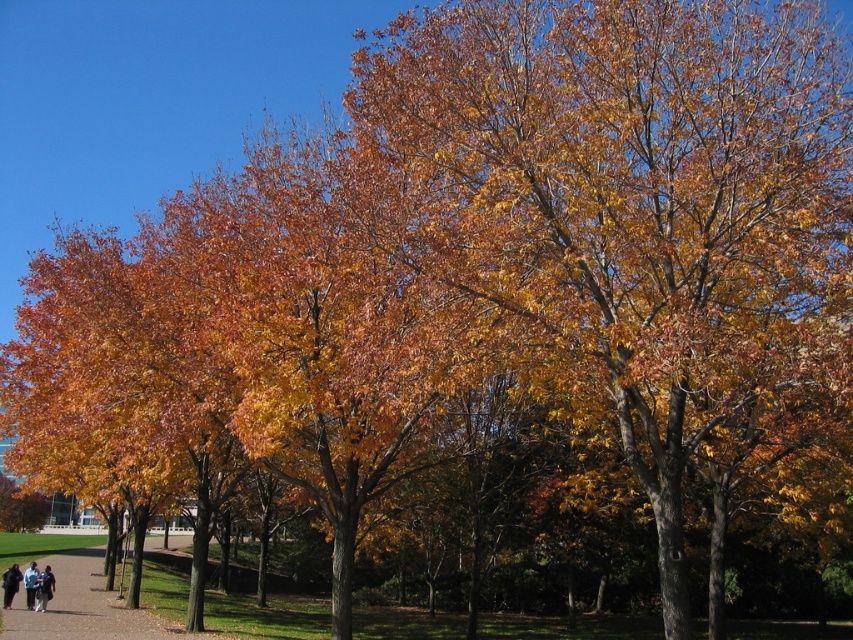
Question: Does dark brown leather jacket at lower left have a larger size compared to light blue denim jacket at lower left?

Choices:
 (A) yes
 (B) no

Answer: (B)

Question: Which object is farther from the camera taking this photo?

Choices:
 (A) dark brown leather jacket at lower left
 (B) light blue denim jacket at lower left
 (C) dark blue jeans at lower left

Answer: (A)

Question: Estimate the real-world distances between objects in this image. Which object is closer to the light blue denim jacket at lower left?

Choices:
 (A) dark brown leather jacket at lower left
 (B) dark blue jeans at lower left

Answer: (B)

Question: Can you confirm if dark blue jeans at lower left is positioned to the left of dark brown leather jacket at lower left?

Choices:
 (A) no
 (B) yes

Answer: (A)

Question: Which of the following is the closest to the observer?

Choices:
 (A) dark brown leather jacket at lower left
 (B) light blue denim jacket at lower left

Answer: (B)

Question: Is dark blue jeans at lower left positioned behind light blue denim jacket at lower left?

Choices:
 (A) no
 (B) yes

Answer: (A)